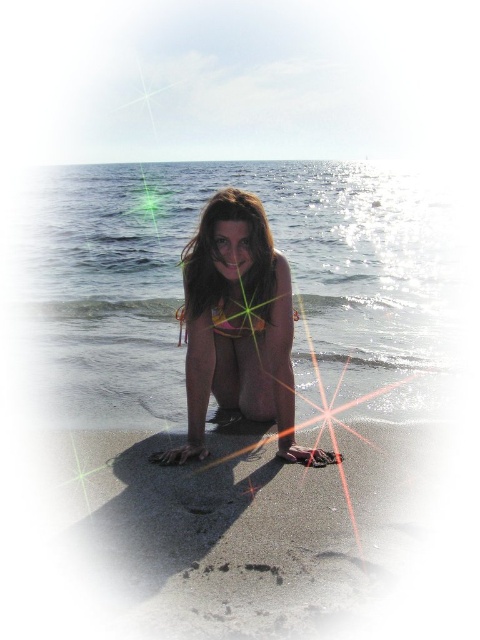
Is point (283, 536) closer to camera compared to point (244, 390)?

Yes, it is.

Between smooth golden sand at lower center and orange bikini at center, which one appears on the right side from the viewer's perspective?

smooth golden sand at lower center

Does point (264, 512) lie in front of point (202, 452)?

Yes, point (264, 512) is in front of point (202, 452).

This screenshot has width=480, height=640. In order to click on smooth golden sand at lower center in this screenshot , I will do `click(237, 529)`.